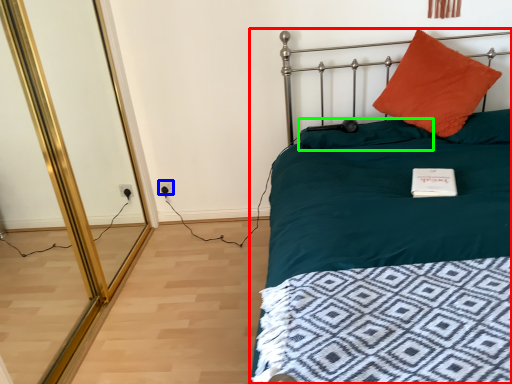
Question: Which is farther away from bed (highlighted by a red box)? electric outlet (highlighted by a blue box) or pillow (highlighted by a green box)?

Choices:
 (A) electric outlet
 (B) pillow

Answer: (A)